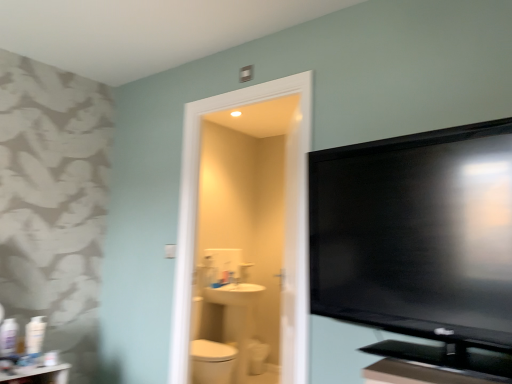
Question: Is white glossy toilet bowl at center to the left of white glossy table at lower left from the viewer's perspective?

Choices:
 (A) no
 (B) yes

Answer: (A)

Question: Is white glossy toilet bowl at center turned away from white glossy table at lower left?

Choices:
 (A) no
 (B) yes

Answer: (A)

Question: Does white glossy toilet bowl at center appear on the right side of white glossy table at lower left?

Choices:
 (A) no
 (B) yes

Answer: (B)

Question: From a real-world perspective, is white glossy toilet bowl at center on top of white glossy table at lower left?

Choices:
 (A) yes
 (B) no

Answer: (B)

Question: Does white glossy toilet bowl at center have a lesser width compared to white glossy table at lower left?

Choices:
 (A) yes
 (B) no

Answer: (A)

Question: Considering their positions, is white glossy toilet bowl at center located in front of or behind white glossy table at lower left?

Choices:
 (A) behind
 (B) front

Answer: (A)

Question: Based on their sizes in the image, would you say white glossy toilet bowl at center is bigger or smaller than white glossy table at lower left?

Choices:
 (A) big
 (B) small

Answer: (B)

Question: Considering the relative positions of white glossy toilet bowl at center and white glossy table at lower left in the image provided, is white glossy toilet bowl at center to the left or to the right of white glossy table at lower left?

Choices:
 (A) right
 (B) left

Answer: (A)

Question: Is white glossy toilet bowl at center wider or thinner than white glossy table at lower left?

Choices:
 (A) thin
 (B) wide

Answer: (A)

Question: From their relative heights in the image, would you say white glossy toilet bowl at center is taller or shorter than white glossy sink at center?

Choices:
 (A) tall
 (B) short

Answer: (A)

Question: From the image's perspective, is white glossy toilet bowl at center located above or below white glossy sink at center?

Choices:
 (A) below
 (B) above

Answer: (A)

Question: Does point (264, 355) appear closer or farther from the camera than point (223, 296)?

Choices:
 (A) closer
 (B) farther

Answer: (B)

Question: Is white glossy toilet bowl at center situated inside white glossy sink at center or outside?

Choices:
 (A) outside
 (B) inside

Answer: (A)

Question: Is black glossy flat-screen tv at right inside or outside of white glossy toilet bowl at center?

Choices:
 (A) inside
 (B) outside

Answer: (B)

Question: Is black glossy flat-screen tv at right in front of or behind white glossy toilet bowl at center in the image?

Choices:
 (A) behind
 (B) front

Answer: (B)